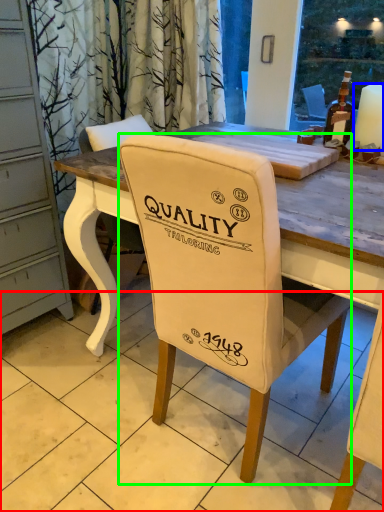
Question: Estimate the real-world distances between objects in this image. Which object is farther from tile (highlighted by a red box), candle (highlighted by a blue box) or chair (highlighted by a green box)?

Choices:
 (A) candle
 (B) chair

Answer: (A)